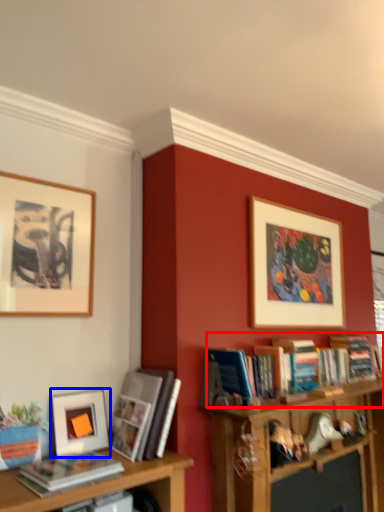
Question: Which of the following is the farthest to the observer, book (highlighted by a red box) or picture frame (highlighted by a blue box)?

Choices:
 (A) book
 (B) picture frame

Answer: (A)